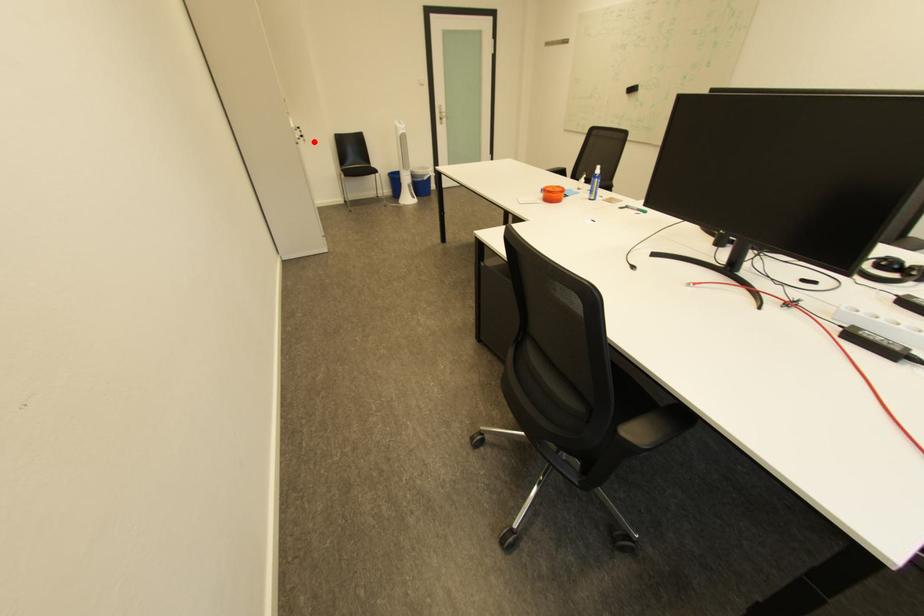
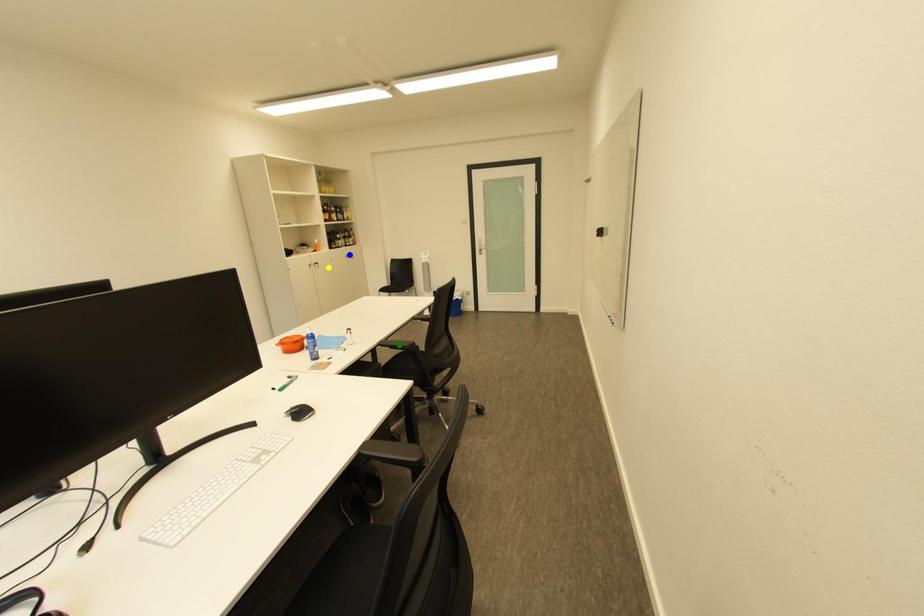
Question: I am providing you with two images of the same scene from different viewpoints. A red point is marked on the first image. You are given multiple points on the second image. Which point in image 2 is actually the same real-world point as the red point in image 1?

Choices:
 (A) yellow point
 (B) green point
 (C) blue point

Answer: (A)